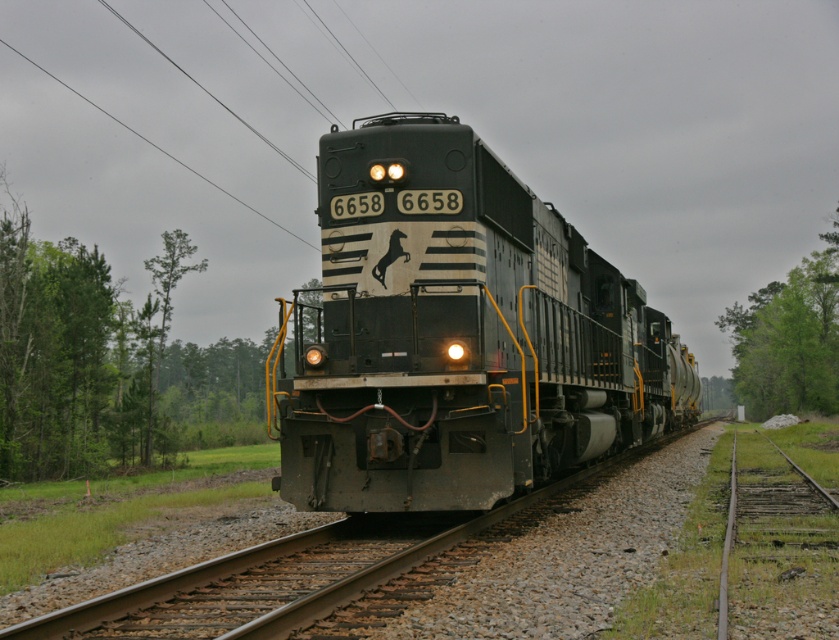
Is green leafy tree at left thinner than green leafy tree at right?

Incorrect, green leafy tree at left's width is not less than green leafy tree at right's.

Locate an element on the screen. The width and height of the screenshot is (839, 640). green leafy tree at left is located at coordinates (108, 362).

Identify the location of metallic locomotive at center. Image resolution: width=839 pixels, height=640 pixels. (459, 333).

Is metallic locomotive at center shorter than green leafy tree at right?

Yes, metallic locomotive at center is shorter than green leafy tree at right.

Who is more forward, (451, 481) or (790, 353)?

Point (451, 481) is in front.

The height and width of the screenshot is (640, 839). Identify the location of metallic locomotive at center. (459, 333).

Looking at this image, who is shorter, metallic locomotive at center or green leafy tree at left?

metallic locomotive at center

Does metallic locomotive at center have a greater height compared to green leafy tree at left?

In fact, metallic locomotive at center may be shorter than green leafy tree at left.

Does point (558, 380) lie in front of point (162, 438)?

Yes, it is.

Find the location of `metallic locomotive at center`. metallic locomotive at center is located at coordinates (459, 333).